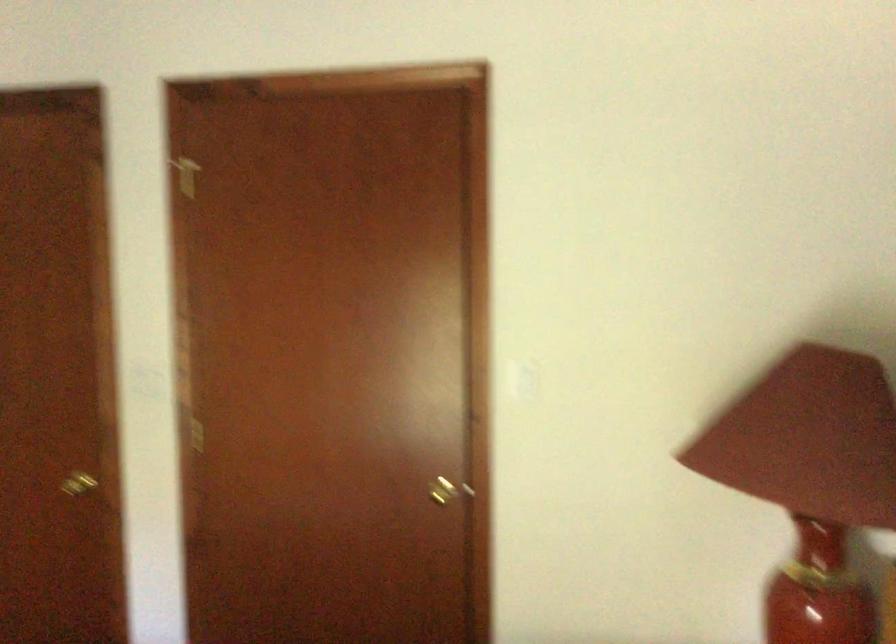
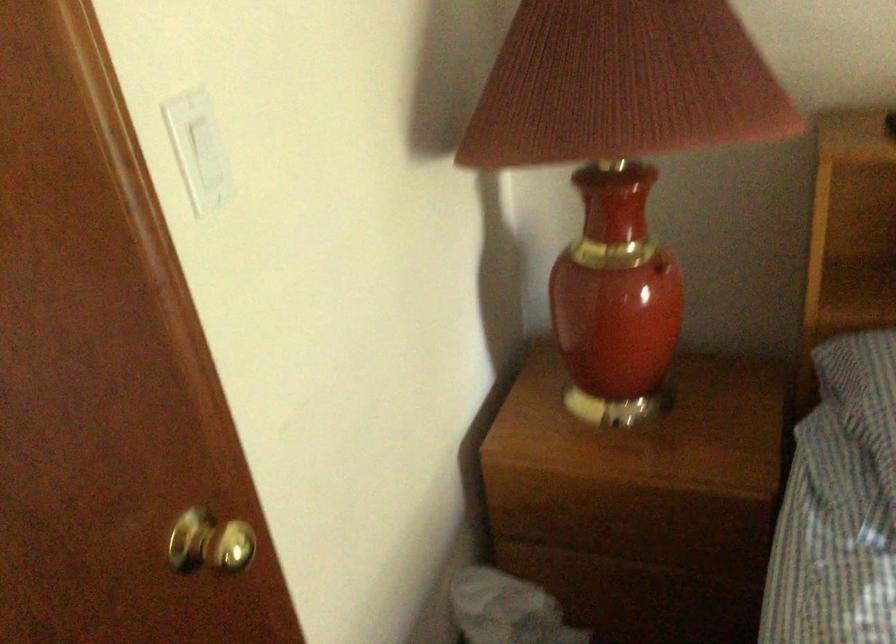
Find the pixel in the second image that matches the point at 521,360 in the first image.

(197, 149)